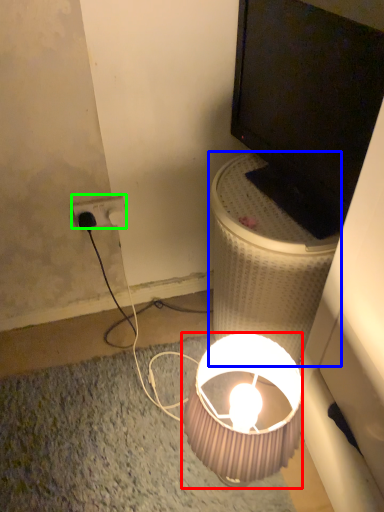
Question: Which object is the closest to the lamp (highlighted by a red box)? Choose among these: table (highlighted by a blue box) or power outlet (highlighted by a green box).

Choices:
 (A) table
 (B) power outlet

Answer: (A)